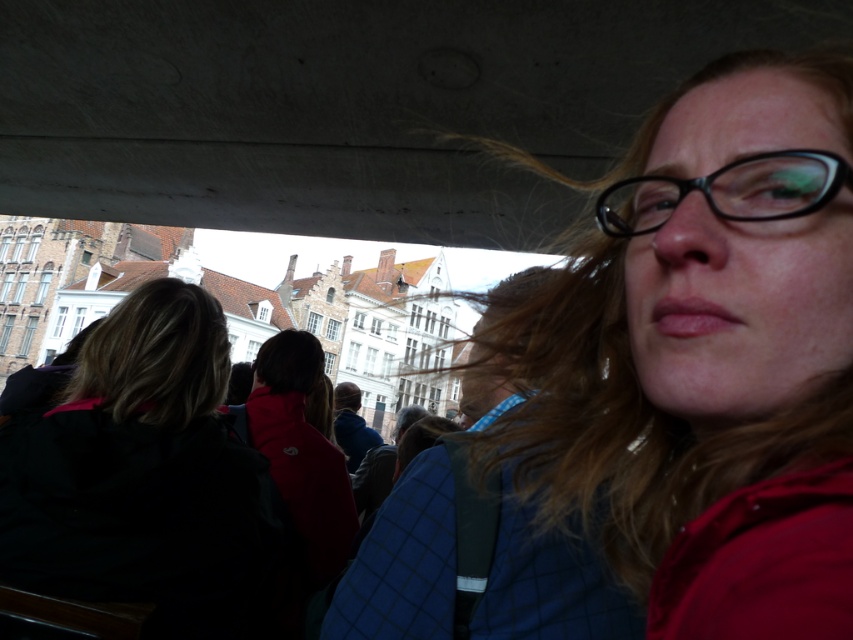
Between matte black glasses at upper right and dark brown hair at center, which one is positioned lower?

Positioned lower is dark brown hair at center.

The height and width of the screenshot is (640, 853). What are the coordinates of `matte black glasses at upper right` in the screenshot? It's located at (708, 358).

Find the location of `matte black glasses at upper right`. matte black glasses at upper right is located at coordinates (708, 358).

Is dark brown hair at center smaller than black plastic glasses at upper right?

No, dark brown hair at center is not smaller than black plastic glasses at upper right.

Between dark brown hair at center and black plastic glasses at upper right, which one has less height?

Standing shorter between the two is black plastic glasses at upper right.

This screenshot has width=853, height=640. What do you see at coordinates (148, 480) in the screenshot? I see `dark brown hair at center` at bounding box center [148, 480].

The width and height of the screenshot is (853, 640). Identify the location of dark brown hair at center. (148, 480).

Can you confirm if matte black glasses at upper right is positioned to the left of black plastic glasses at upper right?

Correct, you'll find matte black glasses at upper right to the left of black plastic glasses at upper right.

Is point (670, 598) positioned after point (757, 157)?

No.

Is point (584, 476) farther from camera compared to point (728, 196)?

Yes.

Locate an element on the screen. matte black glasses at upper right is located at coordinates (708, 358).